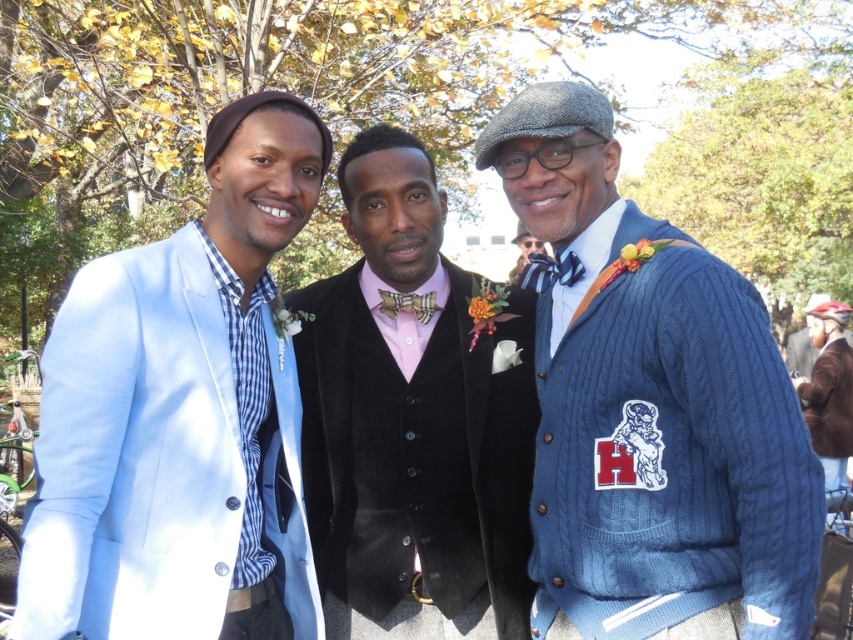
Question: Does pink velvet vest at center appear over plaid fabric bow tie at center?

Choices:
 (A) no
 (B) yes

Answer: (A)

Question: Can you confirm if checkered fabric tie at center is positioned below plaid fabric bow tie at center?

Choices:
 (A) no
 (B) yes

Answer: (A)

Question: Which object is positioned closest to the cable knit sweater at right?

Choices:
 (A) cable knit sweater at center
 (B) pink velvet vest at center
 (C) checkered fabric tie at center

Answer: (B)

Question: Which object appears farthest from the camera in this image?

Choices:
 (A) light blue fabric jacket at left
 (B) plaid fabric bow tie at center
 (C) pink velvet vest at center
 (D) checkered fabric tie at center

Answer: (B)

Question: Observing the image, what is the correct spatial positioning of pink velvet vest at center in reference to plaid fabric bow tie at center?

Choices:
 (A) above
 (B) below

Answer: (B)

Question: Considering the real-world distances, which object is farthest from the plaid fabric bow tie at center?

Choices:
 (A) cable knit sweater at center
 (B) light blue fabric jacket at left
 (C) cable knit sweater at right
 (D) pink velvet vest at center

Answer: (A)